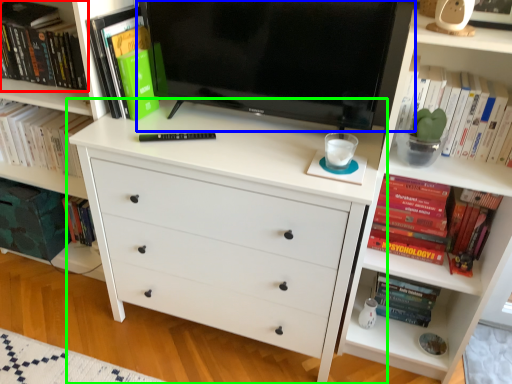
Question: Estimate the real-world distances between objects in this image. Which object is closer to book (highlighted by a red box), television (highlighted by a blue box) or chest of drawers (highlighted by a green box)?

Choices:
 (A) television
 (B) chest of drawers

Answer: (A)